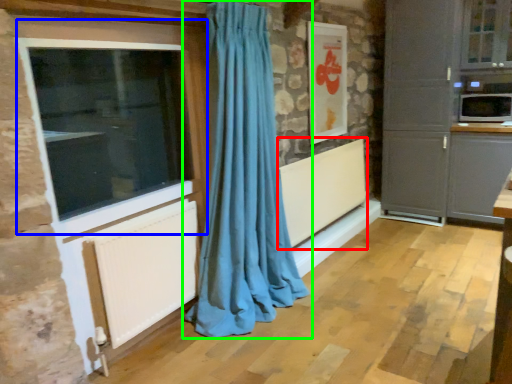
Question: Estimate the real-world distances between objects in this image. Which object is closer to radiator (highlighted by a red box), window (highlighted by a blue box) or curtain (highlighted by a green box)?

Choices:
 (A) window
 (B) curtain

Answer: (B)